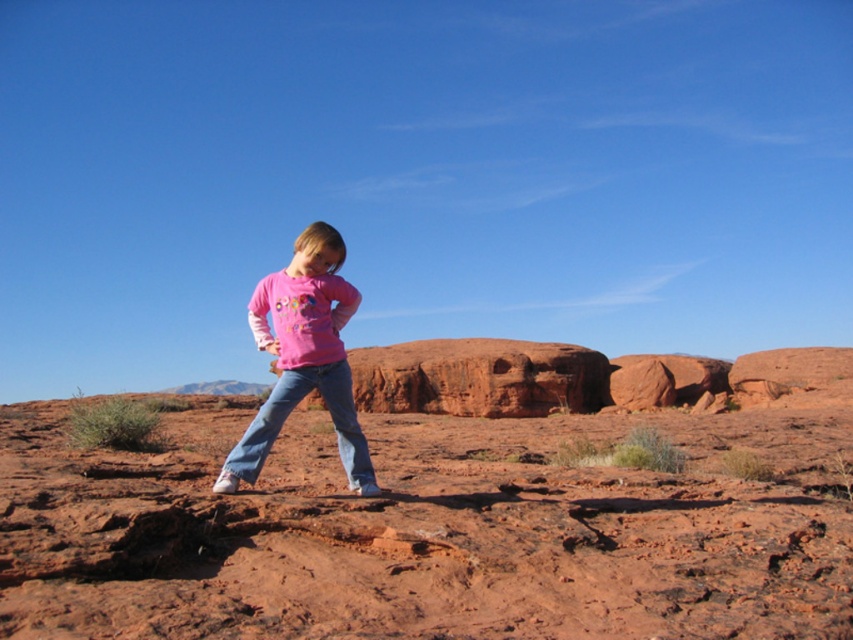
Can you confirm if smooth sand at center is positioned below pink cotton shirt at center?

Correct, smooth sand at center is located below pink cotton shirt at center.

Which is in front, point (679, 557) or point (355, 416)?

Positioned in front is point (679, 557).

Find the location of a particular element. smooth sand at center is located at coordinates (432, 529).

Is point (328, 353) positioned behind point (276, 412)?

No, (328, 353) is in front of (276, 412).

This screenshot has width=853, height=640. Describe the element at coordinates (303, 356) in the screenshot. I see `pink cotton shirt at center` at that location.

Is point (263, 337) less distant than point (328, 371)?

No.

Identify the location of pink cotton shirt at center. (303, 356).

Is point (206, 602) farther from viewer compared to point (282, 394)?

No.

Does point (311, 422) come in front of point (291, 410)?

No, (311, 422) is further to viewer.

Locate an element on the screen. smooth sand at center is located at coordinates (432, 529).